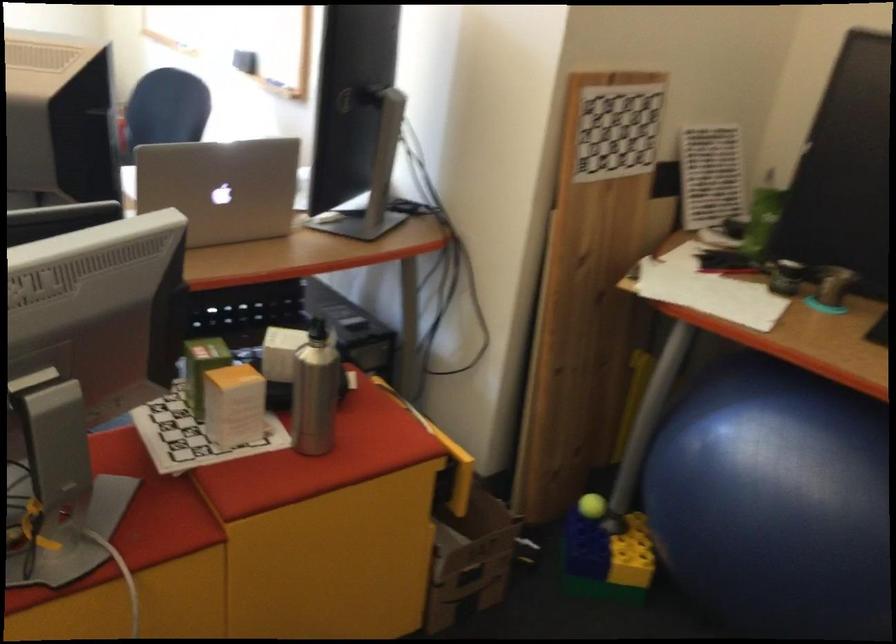
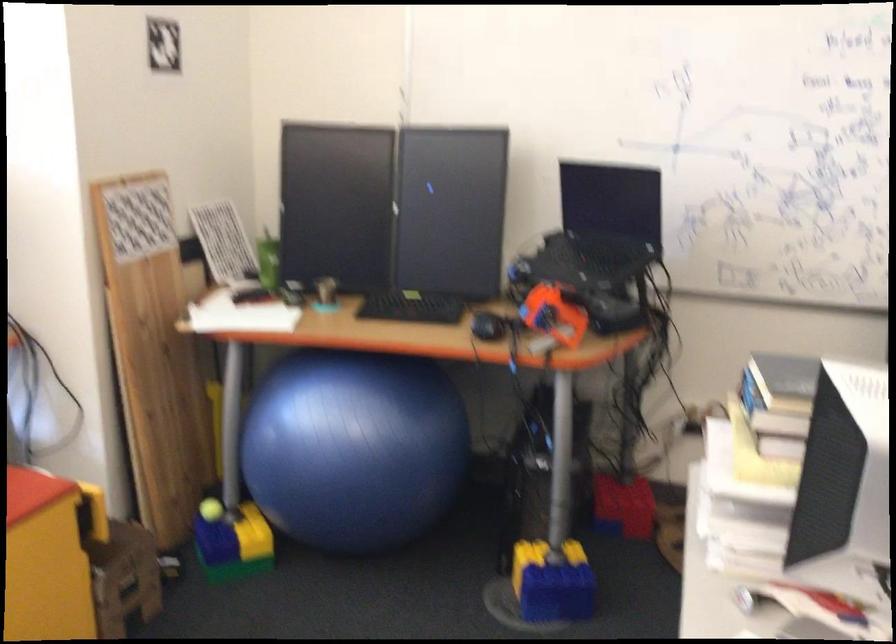
Locate, in the second image, the point that corresponds to pixel 796 527 in the first image.

(355, 448)